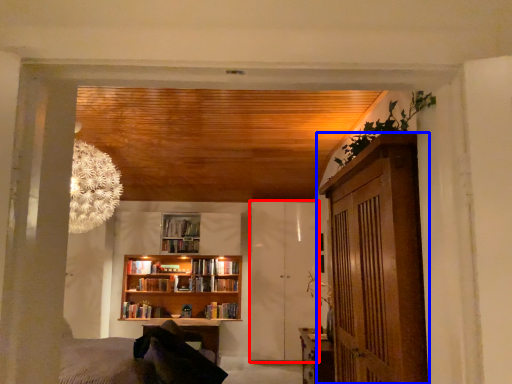
Question: Among these objects, which one is farthest to the camera, barn door (highlighted by a red box) or cabinetry (highlighted by a blue box)?

Choices:
 (A) barn door
 (B) cabinetry

Answer: (A)